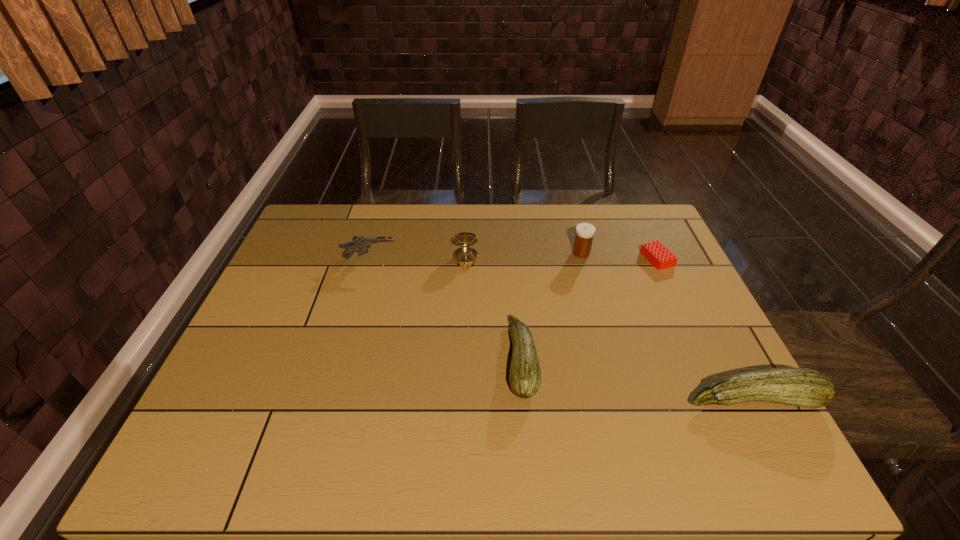
Locate an element on the screen. This screenshot has width=960, height=540. free space located with the dial facing the fifth object from right to left is located at coordinates (465, 296).

Find the location of a particular element. The height and width of the screenshot is (540, 960). vacant region located on the left of the Lego is located at coordinates (527, 259).

What are the coordinates of `blank space located 0.280m at the barrel of the gun` in the screenshot? It's located at point(490,259).

Identify the location of free region located 0.380m on the front of the medicine. The image size is (960, 540). (610, 360).

At what (x,y) coordinates should I click in order to perform the action: click on object that is positioned at the far edge. Please return your answer as a coordinate pair (x, y). Image resolution: width=960 pixels, height=540 pixels. Looking at the image, I should click on (584, 232).

Locate an element on the screen. This screenshot has height=540, width=960. zucchini that is at the right edge is located at coordinates (800, 387).

The width and height of the screenshot is (960, 540). Find the location of `Lego at the right edge`. Lego at the right edge is located at coordinates (655, 252).

Where is `object that is at the near right corner`? The height and width of the screenshot is (540, 960). object that is at the near right corner is located at coordinates (800, 387).

The height and width of the screenshot is (540, 960). Find the location of `vacant space at the far edge`. vacant space at the far edge is located at coordinates (439, 245).

I want to click on free location at the near edge, so (x=372, y=401).